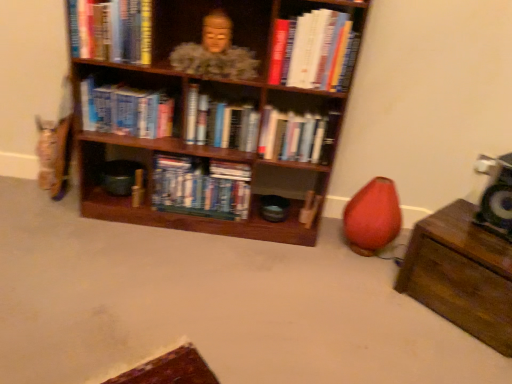
The width and height of the screenshot is (512, 384). What are the coordinates of `matte gold statue at upper center` in the screenshot? It's located at coord(215,52).

What is the approximate width of hardcover book at upper right, which appears as the 1th book when viewed from the right?

hardcover book at upper right, which appears as the 1th book when viewed from the right, is 21.02 centimeters wide.

Describe the element at coordinates (297, 136) in the screenshot. This screenshot has width=512, height=384. I see `hardcover books at center, which is counted as the second book, starting from the right` at that location.

What are the coordinates of `hardcover books at center, the fifth book when ordered from left to right` in the screenshot? It's located at (297, 136).

This screenshot has width=512, height=384. Describe the element at coordinates (461, 274) in the screenshot. I see `brown wooden chest at lower right` at that location.

Describe the element at coordinates (201, 187) in the screenshot. This screenshot has height=384, width=512. I see `blue matte bookshelf at center, which appears as the fourth book when viewed from the right` at that location.

This screenshot has height=384, width=512. What do you see at coordinates (220, 122) in the screenshot? I see `hardcover books at center, which is the 3th book from right to left` at bounding box center [220, 122].

At what (x,y) coordinates should I click in order to perform the action: click on matte gold statue at upper center. Please return your answer as a coordinate pair (x, y). The image size is (512, 384). Looking at the image, I should click on (215, 52).

Between point (451, 265) and point (214, 105), which one is positioned in front?

The point (451, 265) is closer to the camera.

Who is shorter, brown wooden chest at lower right or hardcover books at center, which is the 3th book from right to left?

hardcover books at center, which is the 3th book from right to left, is shorter.

Is brown wooden chest at lower right facing towards hardcover books at center, positioned as the fourth book in left-to-right order?

No, brown wooden chest at lower right is not oriented towards hardcover books at center, positioned as the fourth book in left-to-right order.

Is brown wooden chest at lower right placed right next to hardcover books at center, which is the 3th book from right to left?

No, brown wooden chest at lower right is not in contact with hardcover books at center, which is the 3th book from right to left.

From the image's perspective, between hardcover books at center, which is counted as the second book, starting from the right, and green fabric speaker at right, who is located below?

green fabric speaker at right.

Which object is positioned more to the right, hardcover books at center, which is counted as the second book, starting from the right, or green fabric speaker at right?

From the viewer's perspective, green fabric speaker at right appears more on the right side.

Identify the location of speaker lying below the hardcover books at center, the fifth book when ordered from left to right (from the image's perspective). The image size is (512, 384). (496, 194).

Which is in front, point (303, 156) or point (477, 221)?

The point (477, 221) is more forward.

From a real-world perspective, is hardcover books at center, which is counted as the second book, starting from the right, positioned over wooden bookshelf at center based on gravity?

Incorrect, from a real-world perspective, hardcover books at center, which is counted as the second book, starting from the right, is lower than wooden bookshelf at center.

Identify the location of shelf on the left of hardcover books at center, which is counted as the second book, starting from the right. click(225, 118).

Is hardcover books at center, the fifth book when ordered from left to right, in front of or behind wooden bookshelf at center in the image?

Visually, hardcover books at center, the fifth book when ordered from left to right, is located behind wooden bookshelf at center.

From the image's perspective, does hardcover books at center, the fifth book when ordered from left to right, appear lower than wooden bookshelf at center?

Yes, from the image's perspective, hardcover books at center, the fifth book when ordered from left to right, is below wooden bookshelf at center.

Considering the positions of objects blue matte bookshelf at center, placed as the third book when sorted from left to right, and wooden bookshelf at center in the image provided, who is more to the left, blue matte bookshelf at center, placed as the third book when sorted from left to right, or wooden bookshelf at center?

Positioned to the left is blue matte bookshelf at center, placed as the third book when sorted from left to right.

Is blue matte bookshelf at center, which appears as the fourth book when viewed from the right, situated inside wooden bookshelf at center or outside?

blue matte bookshelf at center, which appears as the fourth book when viewed from the right, is inside wooden bookshelf at center.

Is blue matte bookshelf at center, which appears as the fourth book when viewed from the right, turned away from wooden bookshelf at center?

Yes, blue matte bookshelf at center, which appears as the fourth book when viewed from the right,'s orientation is away from wooden bookshelf at center.

Who is bigger, wooden bookshelf at center or green fabric speaker at right?

With larger size is wooden bookshelf at center.

Is wooden bookshelf at center facing away from green fabric speaker at right?

No, green fabric speaker at right is not at the back of wooden bookshelf at center.

From the image's perspective, between wooden bookshelf at center and green fabric speaker at right, which one is located above?

wooden bookshelf at center.

Considering the relative positions of wooden bookshelf at center and green fabric speaker at right in the image provided, is wooden bookshelf at center to the right of green fabric speaker at right from the viewer's perspective?

In fact, wooden bookshelf at center is to the left of green fabric speaker at right.

Is hardcover book at upper left, acting as the 5th book starting from the right, outside of blue matte bookshelf at center, which appears as the fourth book when viewed from the right?

hardcover book at upper left, acting as the 5th book starting from the right, is positioned outside blue matte bookshelf at center, which appears as the fourth book when viewed from the right.

Consider the image. From a real-world perspective, between hardcover book at upper left, acting as the 5th book starting from the right, and blue matte bookshelf at center, placed as the third book when sorted from left to right, who is vertically lower?

blue matte bookshelf at center, placed as the third book when sorted from left to right.

Measure the distance from hardcover book at upper left, marked as the second book in a left-to-right arrangement, to blue matte bookshelf at center, placed as the third book when sorted from left to right.

hardcover book at upper left, marked as the second book in a left-to-right arrangement, and blue matte bookshelf at center, placed as the third book when sorted from left to right, are 24.97 inches apart from each other.

Between point (198, 119) and point (207, 48), which one is positioned behind?

Point (198, 119)

How different are the orientations of hardcover books at center, positioned as the fourth book in left-to-right order, and matte gold statue at upper center in degrees?

5.22 degrees.

Considering the relative positions of hardcover books at center, which is the 3th book from right to left, and matte gold statue at upper center in the image provided, is hardcover books at center, which is the 3th book from right to left, to the right of matte gold statue at upper center from the viewer's perspective?

Correct, you'll find hardcover books at center, which is the 3th book from right to left, to the right of matte gold statue at upper center.

Is matte gold statue at upper center completely or partially inside hardcover books at center, which is the 3th book from right to left?

No, hardcover books at center, which is the 3th book from right to left, does not contain matte gold statue at upper center.

From the image's perspective, starting from the brown wooden chest at lower right, which book is the 3rd one above? Please provide its 2D coordinates.

[(220, 122)]

Where is `speaker below the hardcover books at center, the fifth book when ordered from left to right (from the image's perspective)`? The width and height of the screenshot is (512, 384). speaker below the hardcover books at center, the fifth book when ordered from left to right (from the image's perspective) is located at coordinates (496, 194).

Based on their spatial positions, is blue matte bookshelf at center, placed as the third book when sorted from left to right, or matte gold statue at upper center further from green fabric speaker at right?

Among the two, matte gold statue at upper center is located further to green fabric speaker at right.

When comparing their distances from matte gold statue at upper center, does blue matte bookshelf at center, placed as the third book when sorted from left to right, or hardcover books at center, placed as the 1th book when sorted from left to right, seem closer?

→ hardcover books at center, placed as the 1th book when sorted from left to right.

Estimate the real-world distances between objects in this image. Which object is closer to matte pink bean bag chair at lower right, hardcover books at center, placed as the 1th book when sorted from left to right, or hardcover book at upper left, acting as the 5th book starting from the right?

Based on the image, hardcover books at center, placed as the 1th book when sorted from left to right, appears to be nearer to matte pink bean bag chair at lower right.

Estimate the real-world distances between objects in this image. Which object is closer to blue matte bookshelf at center, which appears as the fourth book when viewed from the right, matte gold statue at upper center or hardcover books at center, the sixth book positioned from the right?

hardcover books at center, the sixth book positioned from the right, is closer to blue matte bookshelf at center, which appears as the fourth book when viewed from the right.

Based on their spatial positions, is brown wooden chest at lower right or hardcover book at upper right, which is counted as the sixth book, starting from the left, closer to hardcover book at upper left, marked as the second book in a left-to-right arrangement?

The object closer to hardcover book at upper left, marked as the second book in a left-to-right arrangement, is hardcover book at upper right, which is counted as the sixth book, starting from the left.

Looking at the image, which one is located closer to blue matte bookshelf at center, which appears as the fourth book when viewed from the right, green fabric speaker at right or hardcover books at center, which is counted as the second book, starting from the right?

hardcover books at center, which is counted as the second book, starting from the right, lies closer to blue matte bookshelf at center, which appears as the fourth book when viewed from the right, than the other object.

Which object lies further to the anchor point blue matte bookshelf at center, placed as the third book when sorted from left to right, hardcover book at upper left, marked as the second book in a left-to-right arrangement, or hardcover books at center, which is the 3th book from right to left?

hardcover book at upper left, marked as the second book in a left-to-right arrangement, is positioned further to the anchor blue matte bookshelf at center, placed as the third book when sorted from left to right.

From the image, which object appears to be nearer to blue matte bookshelf at center, placed as the third book when sorted from left to right, hardcover books at center, which is the 3th book from right to left, or hardcover books at center, placed as the 1th book when sorted from left to right?

Among the two, hardcover books at center, which is the 3th book from right to left, is located nearer to blue matte bookshelf at center, placed as the third book when sorted from left to right.

This screenshot has height=384, width=512. I want to click on bean bag chair situated between hardcover books at center, the fifth book when ordered from left to right, and green fabric speaker at right from left to right, so click(x=372, y=217).

Locate an element on the screen. bean bag chair located between wooden bookshelf at center and brown wooden chest at lower right in the left-right direction is located at coordinates (372, 217).

This screenshot has height=384, width=512. Identify the location of person located between wooden bookshelf at center and brown wooden chest at lower right in the left-right direction. (215, 52).

Locate an element on the screen. shelf between hardcover book at upper left, marked as the second book in a left-to-right arrangement, and hardcover books at center, which is counted as the second book, starting from the right, from left to right is located at coordinates (225, 118).